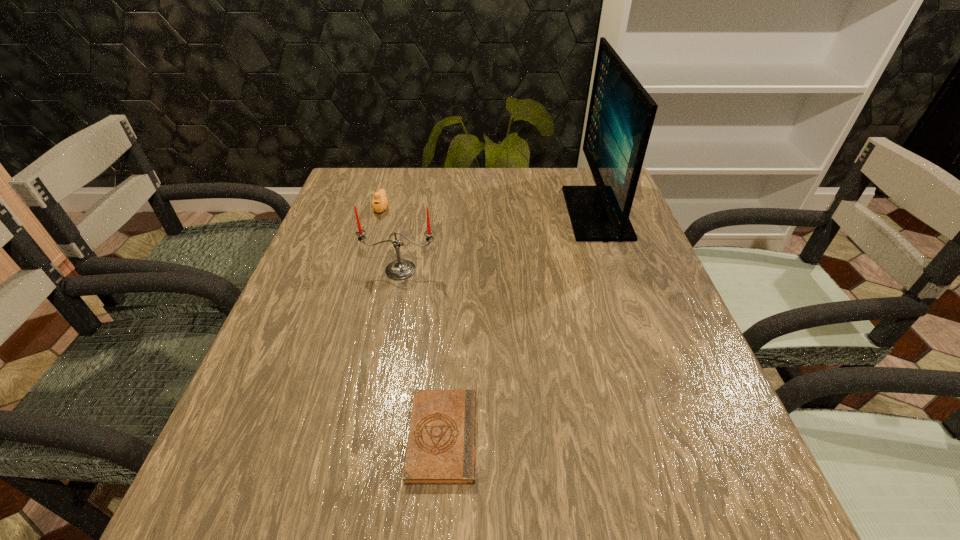
Find the location of a particular element. The width and height of the screenshot is (960, 540). monitor is located at coordinates (621, 114).

At what (x,y) coordinates should I click in order to perform the action: click on the rightmost object. Please return your answer as a coordinate pair (x, y). Looking at the image, I should click on (621, 114).

This screenshot has height=540, width=960. Identify the location of candle. (400, 269).

What are the coordinates of `duckling` in the screenshot? It's located at (379, 202).

The image size is (960, 540). I want to click on the nearest object, so click(x=441, y=445).

This screenshot has height=540, width=960. What are the coordinates of `diary` in the screenshot? It's located at (441, 445).

In order to click on vacant space located 0.240m on the screen side of the rightmost object in this screenshot , I will do `click(478, 213)`.

Identify the location of free spot located 0.130m on the screen side of the rightmost object. The image size is (960, 540). (519, 213).

The height and width of the screenshot is (540, 960). Find the location of `vacant space situated 0.070m on the screen side of the rightmost object`. vacant space situated 0.070m on the screen side of the rightmost object is located at coordinates (542, 213).

You are a GUI agent. You are given a task and a screenshot of the screen. Output one action in this format:
    pyautogui.click(x=<x>, y=<y>)
    Task: Click on the free space located on the front-facing side of the candle
    This screenshot has height=540, width=960.
    Given the screenshot: What is the action you would take?
    pyautogui.click(x=388, y=336)